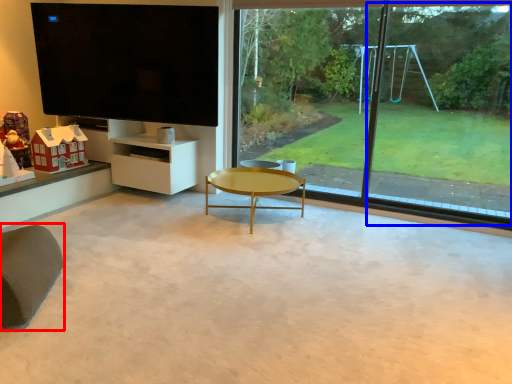
Question: Which of the following is the closest to the observer, swivel chair (highlighted by a red box) or window frame (highlighted by a blue box)?

Choices:
 (A) swivel chair
 (B) window frame

Answer: (A)